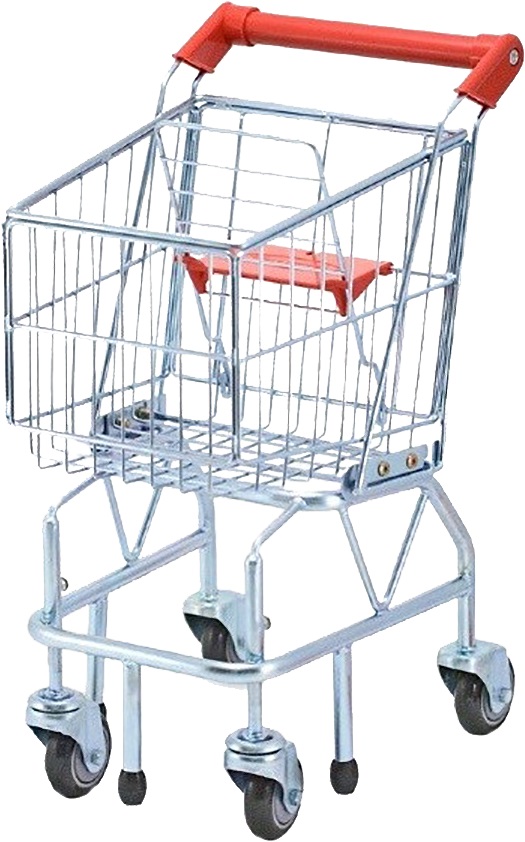
This screenshot has width=525, height=842. What are the coordinates of `plastics seat pad` in the screenshot? It's located at (362, 275).